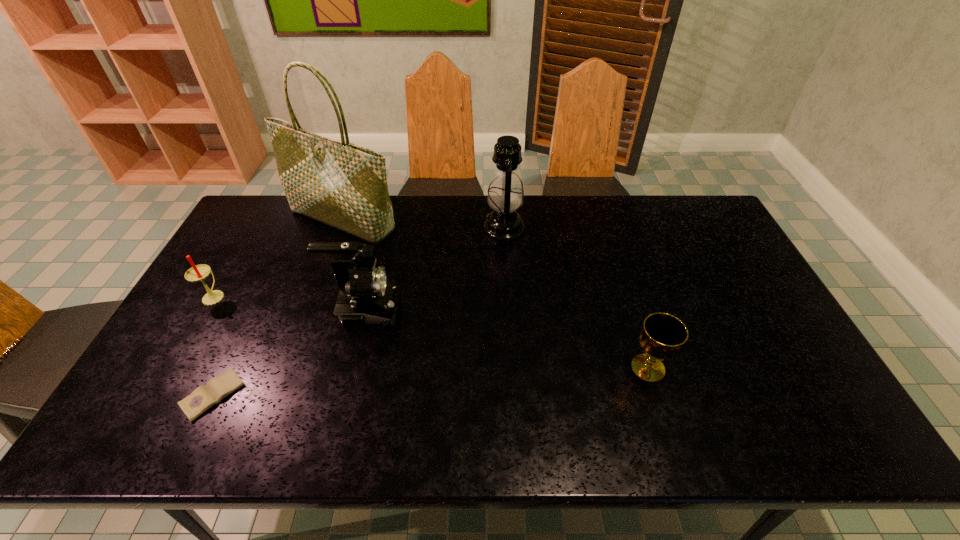
This screenshot has width=960, height=540. I want to click on vacant region located on the right of the candle, so click(x=293, y=295).

At what (x,y) coordinates should I click in order to perform the action: click on free space located on the back of the chalice. Please return your answer as a coordinate pair (x, y). The width and height of the screenshot is (960, 540). Looking at the image, I should click on (618, 272).

At what (x,y) coordinates should I click in order to perform the action: click on vacant position located 0.340m on the back of the diary. Please return your answer as a coordinate pair (x, y). The width and height of the screenshot is (960, 540). Looking at the image, I should click on (270, 275).

What are the coordinates of `shopping bag that is at the far edge` in the screenshot? It's located at (341, 184).

I want to click on oil lamp located in the far edge section of the desktop, so click(505, 196).

Where is `object that is at the near edge`? This screenshot has width=960, height=540. object that is at the near edge is located at coordinates (204, 397).

Where is `shopping bag located in the left edge section of the desktop`? The height and width of the screenshot is (540, 960). shopping bag located in the left edge section of the desktop is located at coordinates (341, 184).

This screenshot has width=960, height=540. I want to click on candle that is positioned at the left edge, so click(x=197, y=273).

At what (x,y) coordinates should I click in order to perform the action: click on diary at the left edge. Please return your answer as a coordinate pair (x, y). Looking at the image, I should click on (204, 397).

Locate an element on the screen. This screenshot has height=540, width=960. object that is at the far left corner is located at coordinates (341, 184).